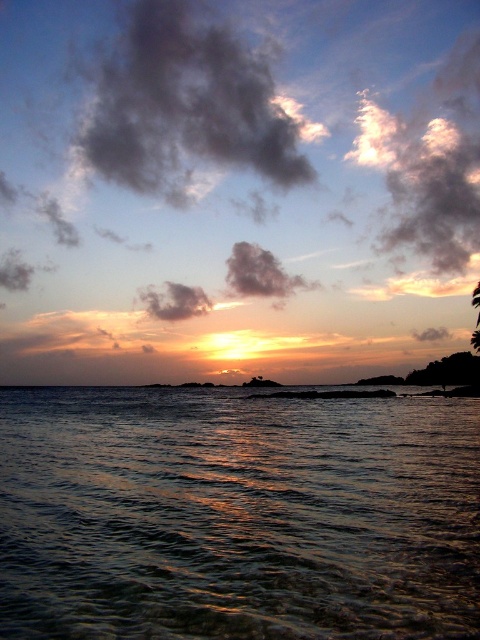
You are standing on the shore observing the sunset scene. There is a shiny reflective water at center marked by point (237, 516). Where would you look to see the reflection of the sun in the water?

The reflection of the sun would be at the shiny reflective water at center marked by point (237, 516) because that is where the water is reflecting the sunlight.

You are standing on the shore of the sunset scene and notice two points in the water. The first point is at coordinates point (327,630) and the second is at point (367,163). Which point is closer to you?

Point (327,630) is closer to the viewer than point (367,163).

You are standing on a cliff overlooking the sunset scene. You want to throw a small stone to hit both the dark gray cloud at upper center and the fuzzy white cloud at upper right. Is it possible to hit both with a single throw?

The distance between the dark gray cloud at upper center and the fuzzy white cloud at upper right is 68.39 meters. Since clouds are located in the sky and the distance between them is quite large, it is impossible to hit both with a single stone throw from the cliff.